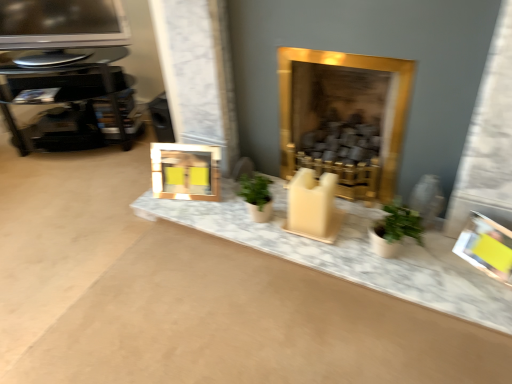
You are a GUI agent. You are given a task and a screenshot of the screen. Output one action in this format:
    pyautogui.click(x=<x>, y=<y>)
    Task: Click on the free spot in front of marble counter top at center
    Image resolution: width=512 pixels, height=384 pixels.
    Given the screenshot: What is the action you would take?
    pyautogui.click(x=313, y=325)